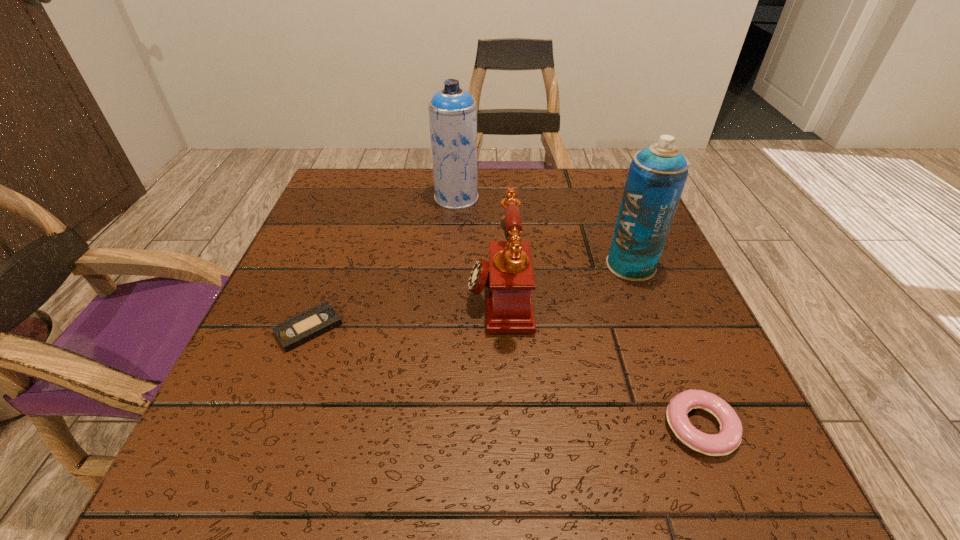
The image size is (960, 540). I want to click on object that is at the near right corner, so click(729, 438).

In the image, there is a desktop. At what (x,y) coordinates should I click in order to perform the action: click on free space at the far edge. Please return your answer as a coordinate pair (x, y). This screenshot has width=960, height=540. Looking at the image, I should click on (424, 206).

Image resolution: width=960 pixels, height=540 pixels. I want to click on free space at the near edge of the desktop, so click(556, 455).

The image size is (960, 540). I want to click on vacant space at the left edge of the desktop, so click(361, 231).

Locate an element on the screen. The height and width of the screenshot is (540, 960). free space at the right edge of the desktop is located at coordinates (673, 292).

This screenshot has height=540, width=960. I want to click on free region at the far left corner of the desktop, so click(x=369, y=187).

Image resolution: width=960 pixels, height=540 pixels. In the image, there is a desktop. In order to click on vacant space at the far right corner in this screenshot , I will do `click(603, 201)`.

Locate an element on the screen. vacant space that's between the farther aerosol can and the second shortest object is located at coordinates (578, 313).

The width and height of the screenshot is (960, 540). In order to click on free space between the videotape and the doughnut in this screenshot , I will do `click(504, 377)`.

Locate an element on the screen. This screenshot has width=960, height=540. empty space between the videotape and the left aerosol can is located at coordinates (382, 263).